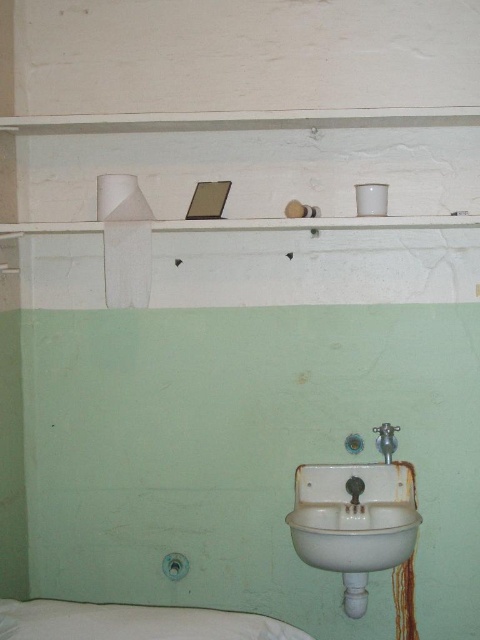
You are a maintenance worker checking the plumbing in this room. You see the white porcelain sink at lower center and the white ceramic faucet at lower center. Which one is taller?

The white porcelain sink at lower center is much taller than the white ceramic faucet at lower center.